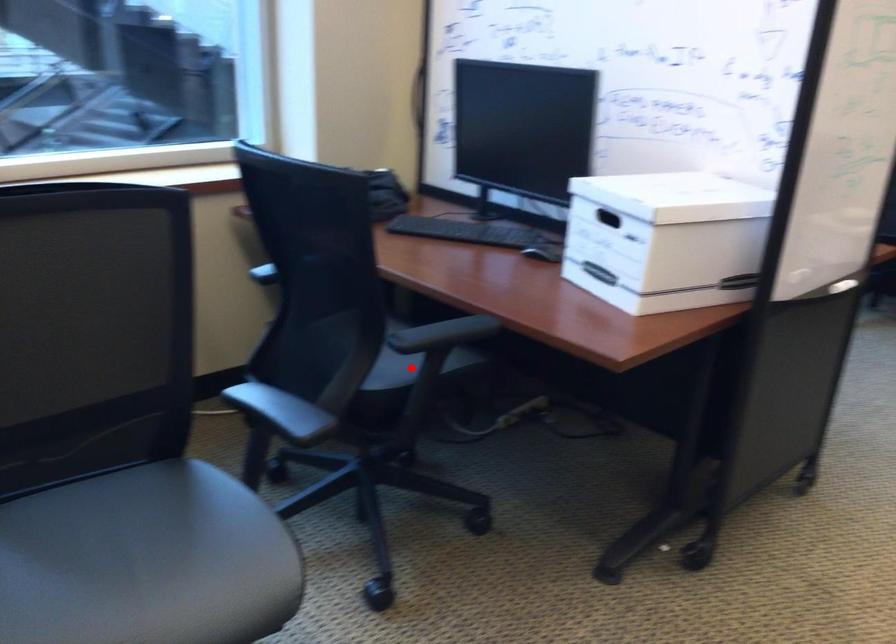
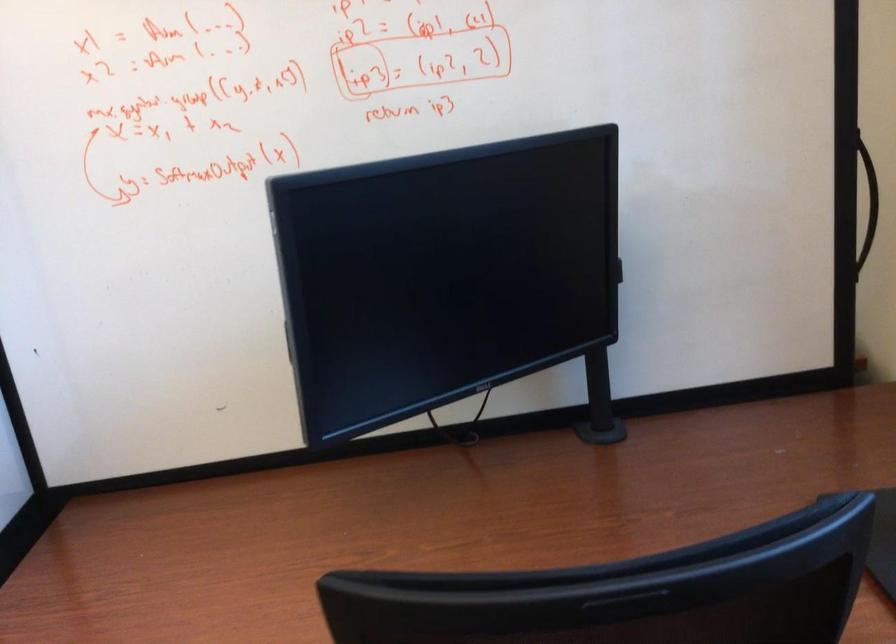
Question: I am providing you with two images of the same scene from different viewpoints. A red point is marked on the first image. Is the red point's position out of view in image 2?

Choices:
 (A) Yes
 (B) No

Answer: (A)